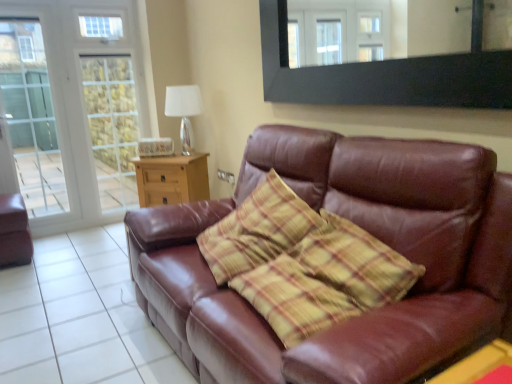
Question: Considering the relative sizes of matte brown leather armchair at left and wooden side table at center, the 2th table when ordered from bottom to top, in the image provided, is matte brown leather armchair at left thinner than wooden side table at center, the 2th table when ordered from bottom to top,?

Choices:
 (A) no
 (B) yes

Answer: (A)

Question: Can you confirm if matte brown leather armchair at left is shorter than wooden side table at center, the 2th table when ordered from bottom to top?

Choices:
 (A) yes
 (B) no

Answer: (A)

Question: Is matte brown leather armchair at left next to wooden side table at center, which is the 1th table in top-to-bottom order, and touching it?

Choices:
 (A) yes
 (B) no

Answer: (B)

Question: Can you confirm if matte brown leather armchair at left is bigger than wooden side table at center, the 2th table positioned from the front?

Choices:
 (A) no
 (B) yes

Answer: (A)

Question: Is wooden side table at center, the first table in the back-to-front sequence, completely or partially inside matte brown leather armchair at left?

Choices:
 (A) yes
 (B) no

Answer: (B)

Question: Considering their positions, is matte brown leather armchair at left located in front of or behind transparent glass door at left?

Choices:
 (A) front
 (B) behind

Answer: (A)

Question: In terms of width, does matte brown leather armchair at left look wider or thinner when compared to transparent glass door at left?

Choices:
 (A) wide
 (B) thin

Answer: (A)

Question: From the image's perspective, is matte brown leather armchair at left positioned above or below transparent glass door at left?

Choices:
 (A) above
 (B) below

Answer: (B)

Question: Is point (3, 196) positioned closer to the camera than point (36, 74)?

Choices:
 (A) farther
 (B) closer

Answer: (B)

Question: Considering their positions, is black matte mirror at upper center located in front of or behind transparent glass door at left?

Choices:
 (A) front
 (B) behind

Answer: (A)

Question: Would you say black matte mirror at upper center is inside or outside transparent glass door at left?

Choices:
 (A) inside
 (B) outside

Answer: (B)

Question: Looking at their shapes, would you say black matte mirror at upper center is wider or thinner than transparent glass door at left?

Choices:
 (A) wide
 (B) thin

Answer: (B)

Question: In the image, is black matte mirror at upper center on the left side or the right side of transparent glass door at left?

Choices:
 (A) left
 (B) right

Answer: (B)

Question: Is point (382, 72) positioned closer to the camera than point (10, 273)?

Choices:
 (A) farther
 (B) closer

Answer: (B)

Question: Would you say black matte mirror at upper center is to the left or to the right of brown leather couch at lower right in the picture?

Choices:
 (A) left
 (B) right

Answer: (B)